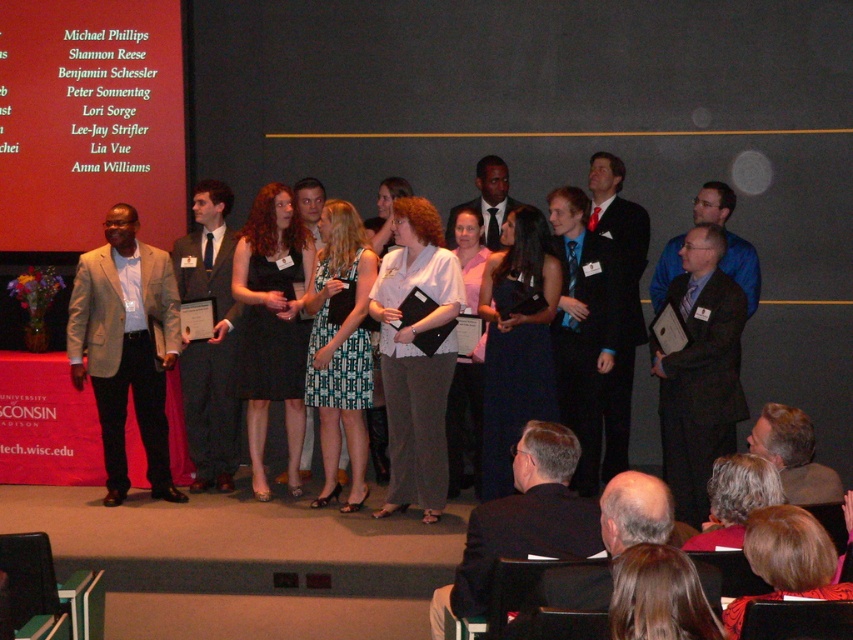
What do you see at coordinates (271, 323) in the screenshot? I see `black dress at center` at bounding box center [271, 323].

In the scene shown: Between black dress at center and printed fabric dress at center, which one has less height?

printed fabric dress at center

Is point (292, 276) positioned after point (350, 467)?

That is False.

This screenshot has width=853, height=640. Identify the location of black dress at center. (271, 323).

Is point (772, 509) closer to viewer compared to point (393, 179)?

That is True.

Does blonde hair at lower right appear under matte white blouse at center?

Yes.

You are a GUI agent. You are given a task and a screenshot of the screen. Output one action in this format:
    pyautogui.click(x=<x>, y=<y>)
    Task: Click on the blonde hair at lower right
    
    Given the screenshot: What is the action you would take?
    pyautogui.click(x=786, y=560)

At what (x,y) coordinates should I click in order to perform the action: click on blonde hair at lower right. Please return your answer as a coordinate pair (x, y). The image size is (853, 640). Looking at the image, I should click on (786, 560).

Is point (165, 260) more distant than point (442, 243)?

Yes, it is behind point (442, 243).

Which of these two, light brown suit at left or white textured blouse at center, stands taller?

Standing taller between the two is white textured blouse at center.

Between point (108, 394) and point (426, 365), which one is positioned behind?

The point (108, 394) is behind.

Image resolution: width=853 pixels, height=640 pixels. Find the location of `light brown suit at left`. light brown suit at left is located at coordinates (126, 346).